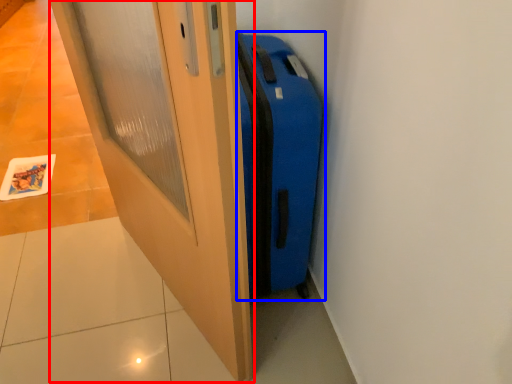
Question: Among these objects, which one is farthest to the camera, door (highlighted by a red box) or suitcase (highlighted by a blue box)?

Choices:
 (A) door
 (B) suitcase

Answer: (B)